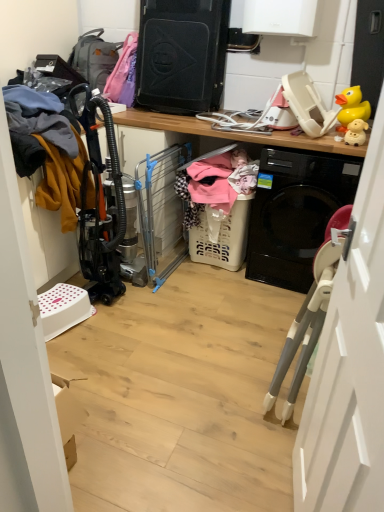
Question: Does yellow rubber duck at upper right, arranged as the first toy when viewed from the back, have a greater width compared to white plastic laundry basket at center?

Choices:
 (A) no
 (B) yes

Answer: (A)

Question: Would you say yellow rubber duck at upper right, the 2th toy viewed from the front, is outside white plastic laundry basket at center?

Choices:
 (A) yes
 (B) no

Answer: (A)

Question: Considering the relative sizes of yellow rubber duck at upper right, the 2th toy viewed from the front, and white plastic laundry basket at center in the image provided, is yellow rubber duck at upper right, the 2th toy viewed from the front, thinner than white plastic laundry basket at center?

Choices:
 (A) no
 (B) yes

Answer: (B)

Question: From the image's perspective, does yellow rubber duck at upper right, the 2th toy viewed from the front, appear higher than white plastic laundry basket at center?

Choices:
 (A) no
 (B) yes

Answer: (B)

Question: From a real-world perspective, does yellow rubber duck at upper right, the second toy from the bottom, stand above white plastic laundry basket at center?

Choices:
 (A) yes
 (B) no

Answer: (A)

Question: Is yellow rubber duck at upper right, the first toy when ordered from top to bottom, shorter than white plastic laundry basket at center?

Choices:
 (A) no
 (B) yes

Answer: (B)

Question: Is the position of white plastic laundry basket at center more distant than that of yellow rubber duck at upper right, the 2th toy viewed from the front?

Choices:
 (A) yes
 (B) no

Answer: (B)

Question: Is white plastic laundry basket at center shorter than yellow rubber duck at upper right, the 2th toy viewed from the front?

Choices:
 (A) no
 (B) yes

Answer: (A)

Question: Is white plastic laundry basket at center surrounding yellow rubber duck at upper right, the second toy from the bottom?

Choices:
 (A) yes
 (B) no

Answer: (B)

Question: Is the position of white plastic laundry basket at center less distant than that of yellow rubber duck at upper right, the second toy from the bottom?

Choices:
 (A) no
 (B) yes

Answer: (B)

Question: From the image's perspective, is white plastic laundry basket at center on yellow rubber duck at upper right, arranged as the first toy when viewed from the back?

Choices:
 (A) no
 (B) yes

Answer: (A)

Question: Considering the relative sizes of white plastic laundry basket at center and yellow rubber duck at upper right, the first toy when ordered from top to bottom, in the image provided, is white plastic laundry basket at center thinner than yellow rubber duck at upper right, the first toy when ordered from top to bottom,?

Choices:
 (A) no
 (B) yes

Answer: (A)

Question: From a real-world perspective, is soft pink fabric at center, the 1th clothing viewed from the right, on top of matte gray backpack at upper left?

Choices:
 (A) no
 (B) yes

Answer: (A)